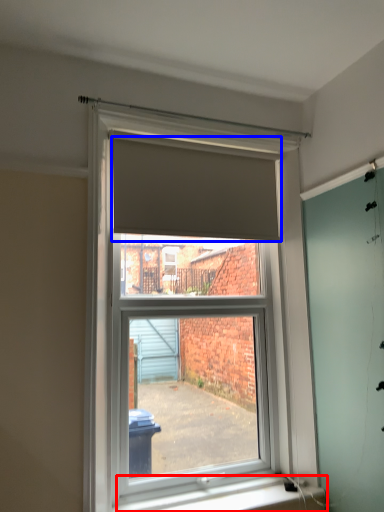
Question: Which of the following is the farthest to the observer, window sill (highlighted by a red box) or blind (highlighted by a blue box)?

Choices:
 (A) window sill
 (B) blind

Answer: (B)